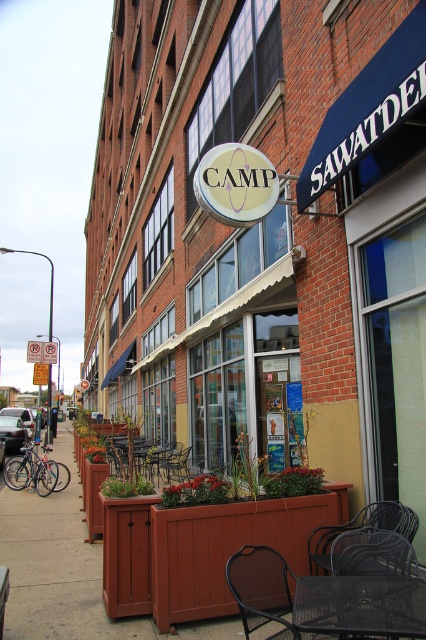
Does point (296, 636) come farther from viewer compared to point (325, 544)?

No, (296, 636) is closer to viewer.

Between black metal chair at center and metallic dark brown chair at lower right, which one is positioned lower?

metallic dark brown chair at lower right is lower down.

Between point (279, 586) and point (344, 525), which one is positioned behind?

Point (344, 525)

This screenshot has height=640, width=426. Identify the location of black metal chair at center. (261, 588).

In the scene shown: Is metallic dark brown chair at lower right positioned behind wooden chair at center?

No, metallic dark brown chair at lower right is closer to the viewer.

Is point (380, 518) behind point (173, 472)?

No, it is in front of (173, 472).

Who is more distant from viewer, (325, 525) or (184, 460)?

Point (184, 460)

Locate an element on the screen. The width and height of the screenshot is (426, 640). metallic dark brown chair at lower right is located at coordinates (362, 528).

Which is behind, point (371, 627) or point (230, 589)?

Point (230, 589)

Which of these two, metallic mesh table at center or black metal chair at center, stands shorter?

metallic mesh table at center is shorter.

Between point (324, 620) and point (284, 576), which one is positioned behind?

Point (284, 576)

At what (x,y) coordinates should I click in order to perform the action: click on metallic mesh table at center. Please return your answer as a coordinate pair (x, y). Looking at the image, I should click on pyautogui.click(x=359, y=605).